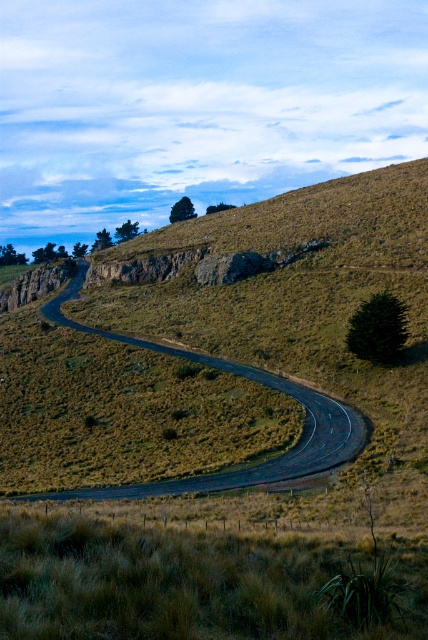
Question: Is dry grass at lower left further to camera compared to black asphalt road at center?

Choices:
 (A) no
 (B) yes

Answer: (A)

Question: Does dry grass at lower left appear on the right side of black asphalt road at center?

Choices:
 (A) yes
 (B) no

Answer: (A)

Question: Can you confirm if dry grass at lower left is positioned to the right of black asphalt road at center?

Choices:
 (A) no
 (B) yes

Answer: (B)

Question: Which point is closer to the camera?

Choices:
 (A) dry grass at lower left
 (B) black asphalt road at center

Answer: (A)